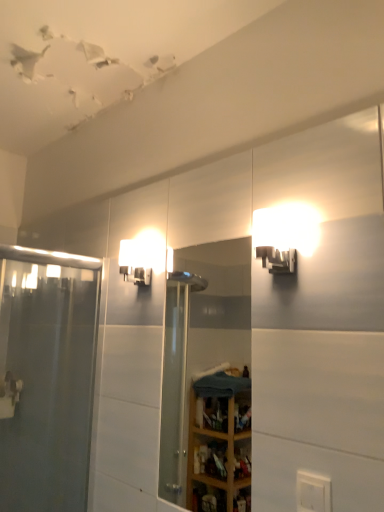
Question: Is matte white sconce at upper center, which is the 1th light fixture from back to front, touching clear glass shower door at left?

Choices:
 (A) yes
 (B) no

Answer: (B)

Question: Could you tell me if matte white sconce at upper center, which is the 1th light fixture from back to front, is facing clear glass shower door at left?

Choices:
 (A) no
 (B) yes

Answer: (A)

Question: Is matte white sconce at upper center, acting as the second light fixture starting from the front, thinner than clear glass shower door at left?

Choices:
 (A) yes
 (B) no

Answer: (B)

Question: Is the position of matte white sconce at upper center, acting as the second light fixture starting from the front, less distant than that of clear glass shower door at left?

Choices:
 (A) no
 (B) yes

Answer: (A)

Question: Is matte white sconce at upper center, which is the 2th light fixture in right-to-left order, behind clear glass shower door at left?

Choices:
 (A) no
 (B) yes

Answer: (B)

Question: Is matte white sconce at upper center, acting as the second light fixture starting from the front, bigger or smaller than clear glass mirror at center?

Choices:
 (A) big
 (B) small

Answer: (B)

Question: From a real-world perspective, is matte white sconce at upper center, which is the 2th light fixture in right-to-left order, positioned above or below clear glass mirror at center?

Choices:
 (A) above
 (B) below

Answer: (A)

Question: Is point (119, 270) positioned closer to the camera than point (175, 358)?

Choices:
 (A) farther
 (B) closer

Answer: (B)

Question: Considering their positions, is matte white sconce at upper center, which ranks as the first light fixture in left-to-right order, located in front of or behind clear glass mirror at center?

Choices:
 (A) behind
 (B) front

Answer: (A)

Question: In terms of height, does clear glass shower door at left look taller or shorter compared to matte white sconce at upper right, the 1th light fixture from the front?

Choices:
 (A) tall
 (B) short

Answer: (A)

Question: Based on their positions, is clear glass shower door at left located to the left or right of matte white sconce at upper right, placed as the 2th light fixture when sorted from left to right?

Choices:
 (A) left
 (B) right

Answer: (A)

Question: Which is correct: clear glass shower door at left is inside matte white sconce at upper right, the first light fixture in the right-to-left sequence, or outside of it?

Choices:
 (A) outside
 (B) inside

Answer: (A)

Question: Considering the positions of clear glass shower door at left and matte white sconce at upper right, the 1th light fixture from the front, in the image, is clear glass shower door at left bigger or smaller than matte white sconce at upper right, the 1th light fixture from the front,?

Choices:
 (A) big
 (B) small

Answer: (A)

Question: Is point (296, 242) positioned closer to the camera than point (203, 340)?

Choices:
 (A) closer
 (B) farther

Answer: (A)

Question: In terms of height, does matte white sconce at upper right, marked as the 2th light fixture in a back-to-front arrangement, look taller or shorter compared to clear glass mirror at center?

Choices:
 (A) tall
 (B) short

Answer: (B)